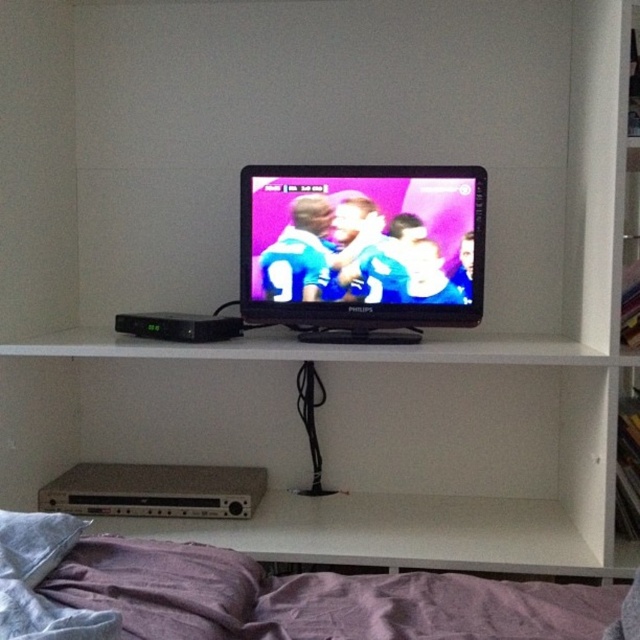
You are standing in front of the shelving unit and want to place a new remote control. You have two spots in mind, one at point [385,579] and another at point [324,170]. Which point is closer to you where you can place it?

Point [385,579] is closer to the viewer than point [324,170], so you can place the remote control there.

You are standing in front of the shelving unit and want to reach the point at coordinates (225, 596). If your arm can extend 3 feet, can you reach it?

The point at coordinates (225, 596) is 3.46 feet away from the viewer, which is slightly beyond the 3 feet reach of your arm. Therefore, you cannot reach it.